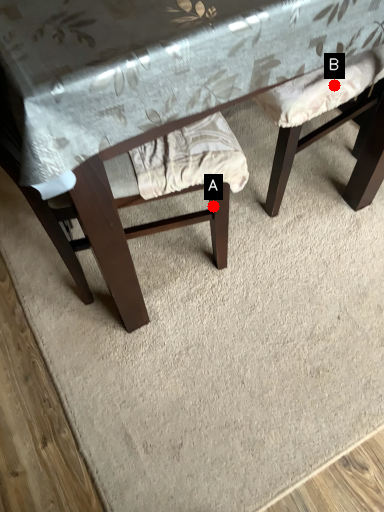
Question: Two points are circled on the image, labeled by A and B beside each circle. Which point appears closest to the camera in this image?

Choices:
 (A) A is closer
 (B) B is closer

Answer: (B)